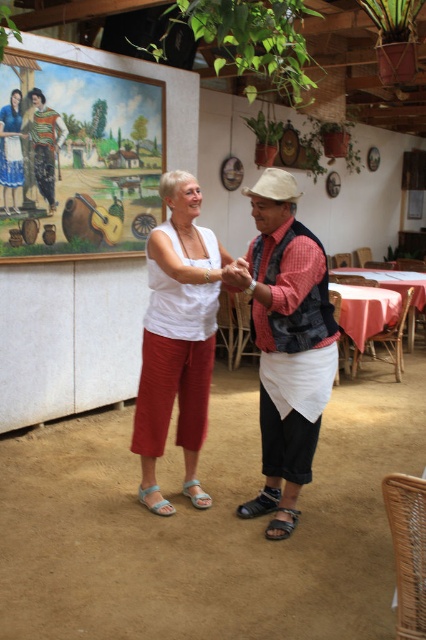
Does light gray fabric sandal at lower left appear on the left side of light blue fabric sandal at lower left?

In fact, light gray fabric sandal at lower left is to the right of light blue fabric sandal at lower left.

Who is more forward, (210,497) or (149,492)?

Point (149,492) is more forward.

What are the coordinates of `light gray fabric sandal at lower left` in the screenshot? It's located at (196, 493).

Where is `light gray fabric sandal at lower left`? light gray fabric sandal at lower left is located at coordinates (196, 493).

Does point (6, 177) lie in front of point (284, 525)?

No, (6, 177) is further to viewer.

Describe the element at coordinates (11, 148) in the screenshot. I see `matte white blouse at center` at that location.

At what (x,y) coordinates should I click in order to perform the action: click on matte white blouse at center. Please return your answer as a coordinate pair (x, y). This screenshot has width=426, height=640. Looking at the image, I should click on (11, 148).

Which of these two, white cotton tank top at center or light blue fabric sandal at lower left, stands shorter?

Standing shorter between the two is light blue fabric sandal at lower left.

Can you confirm if white cotton tank top at center is positioned below light blue fabric sandal at lower left?

Incorrect, white cotton tank top at center is not positioned below light blue fabric sandal at lower left.

Image resolution: width=426 pixels, height=640 pixels. I want to click on white cotton tank top at center, so click(x=178, y=326).